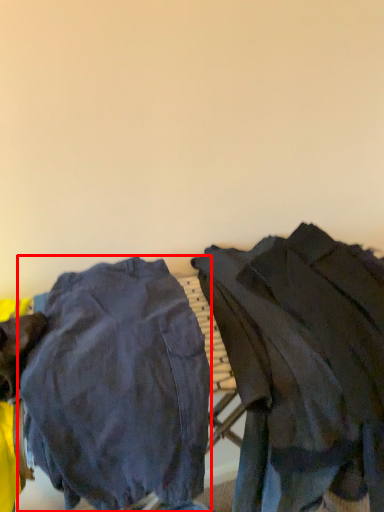
Question: From the image, what is the correct spatial relationship of tight (annotated by the red box) in relation to jacket?

Choices:
 (A) right
 (B) left

Answer: (B)